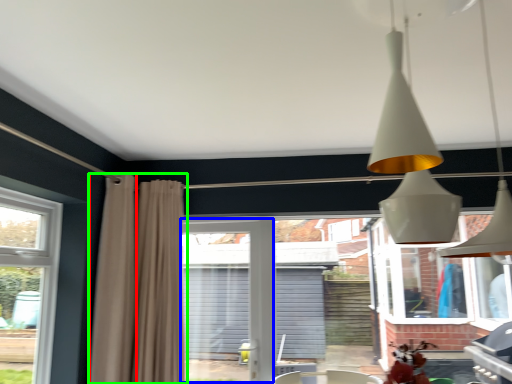
Question: Estimate the real-world distances between objects in this image. Which object is farther from curtain (highlighted by a red box), screen door (highlighted by a blue box) or curtain (highlighted by a green box)?

Choices:
 (A) screen door
 (B) curtain

Answer: (A)